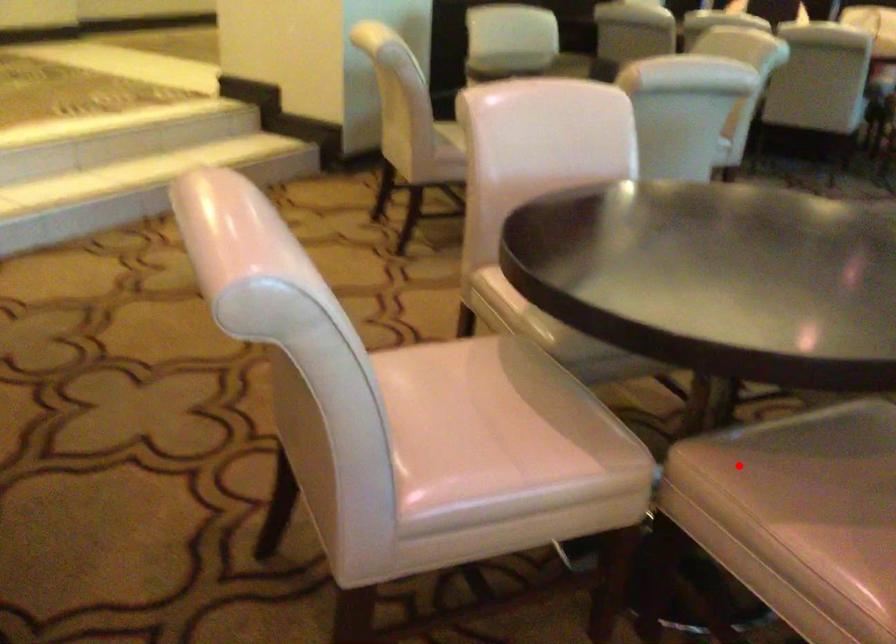
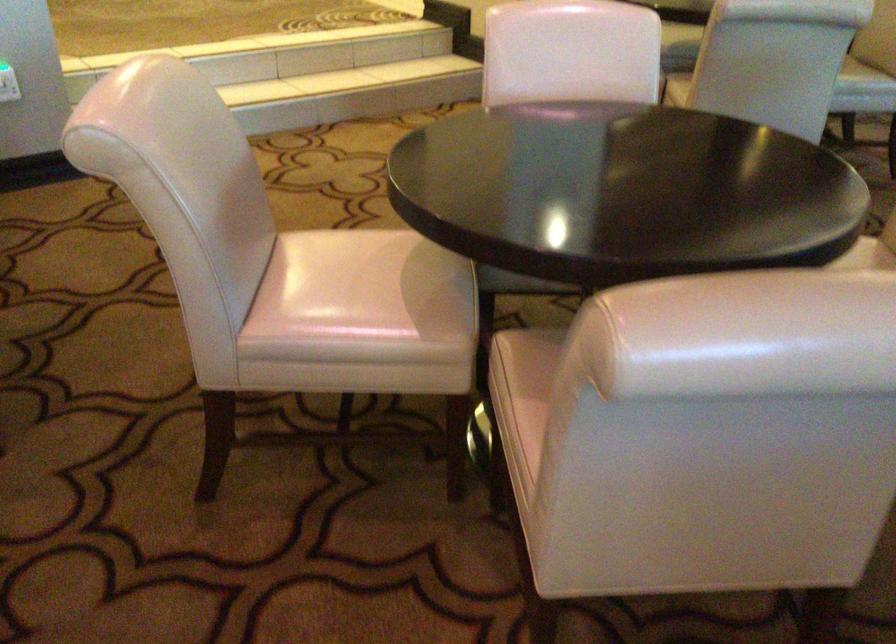
Question: A red point is marked in image1. In image2, is the corresponding 3D point closer to the camera or farther? Reply with the corresponding letter.

Choices:
 (A) The corresponding 3D point is closer.
 (B) The corresponding 3D point is farther.

Answer: (B)